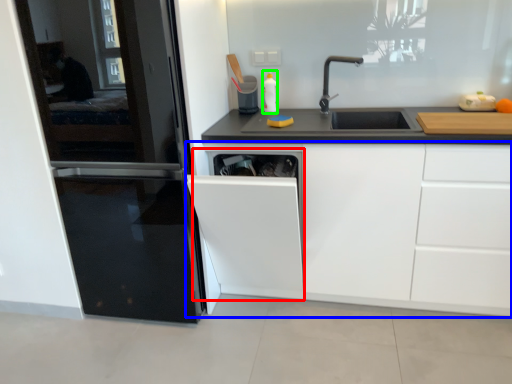
Question: Estimate the real-world distances between objects in this image. Which object is closer to dish washer (highlighted by a red box), cabinetry (highlighted by a blue box) or bottle (highlighted by a green box)?

Choices:
 (A) cabinetry
 (B) bottle

Answer: (A)